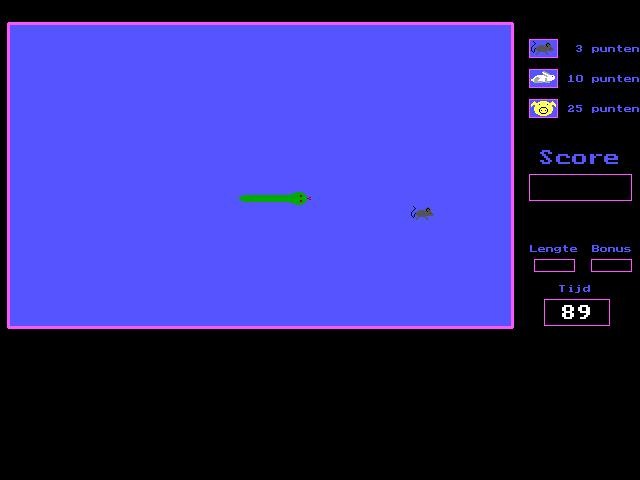
Locate an element on the screen. The height and width of the screenshot is (480, 640). mouse is located at coordinates (534, 48), (419, 212).